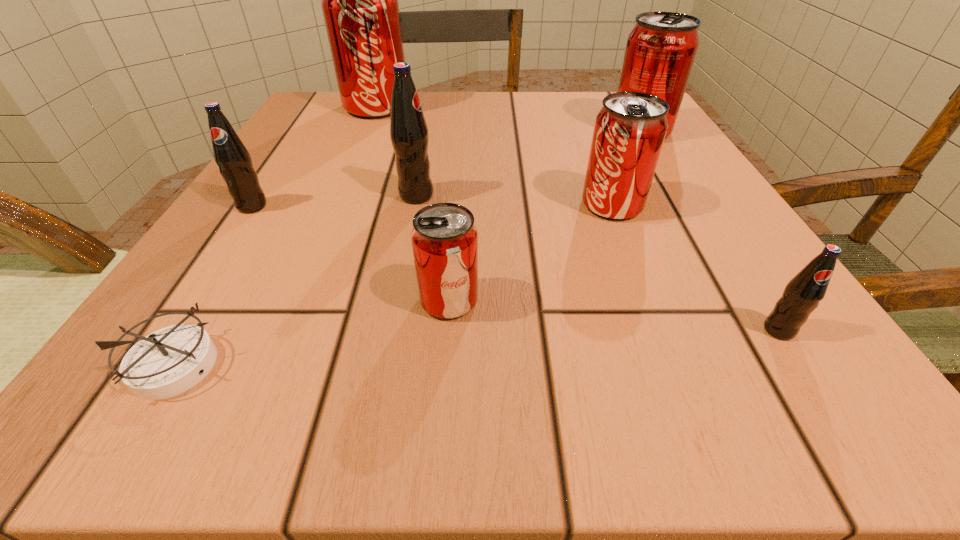
This screenshot has width=960, height=540. I want to click on free space that satisfies the following two spatial constraints: 1. on the front side of the third smallest red pop soda; 2. on the left side of the biggest red pop soda, so pyautogui.click(x=367, y=131).

Locate an element on the screen. free space that satisfies the following two spatial constraints: 1. on the back side of the sixth object from left to right; 2. on the front label of the second black pop from right to left is located at coordinates (609, 195).

At what (x,y) coordinates should I click in order to perform the action: click on free spot that satisfies the following two spatial constraints: 1. on the front side of the third smallest red pop soda; 2. on the left side of the tallest object. Please return your answer as a coordinate pair (x, y). The height and width of the screenshot is (540, 960). Looking at the image, I should click on (367, 131).

Identify the location of vacant space that satisfies the following two spatial constraints: 1. on the front label of the leftmost pop; 2. on the left side of the compass. This screenshot has height=540, width=960. (147, 363).

Where is `free space in the image that satisfies the following two spatial constraints: 1. on the front label of the fourth object from left to right; 2. on the right side of the third red pop soda from right to left`? free space in the image that satisfies the following two spatial constraints: 1. on the front label of the fourth object from left to right; 2. on the right side of the third red pop soda from right to left is located at coordinates (396, 300).

Where is `free spot that satisfies the following two spatial constraints: 1. on the front label of the second black pop from left to right; 2. on the front label of the leftmost pop`? This screenshot has height=540, width=960. free spot that satisfies the following two spatial constraints: 1. on the front label of the second black pop from left to right; 2. on the front label of the leftmost pop is located at coordinates (415, 206).